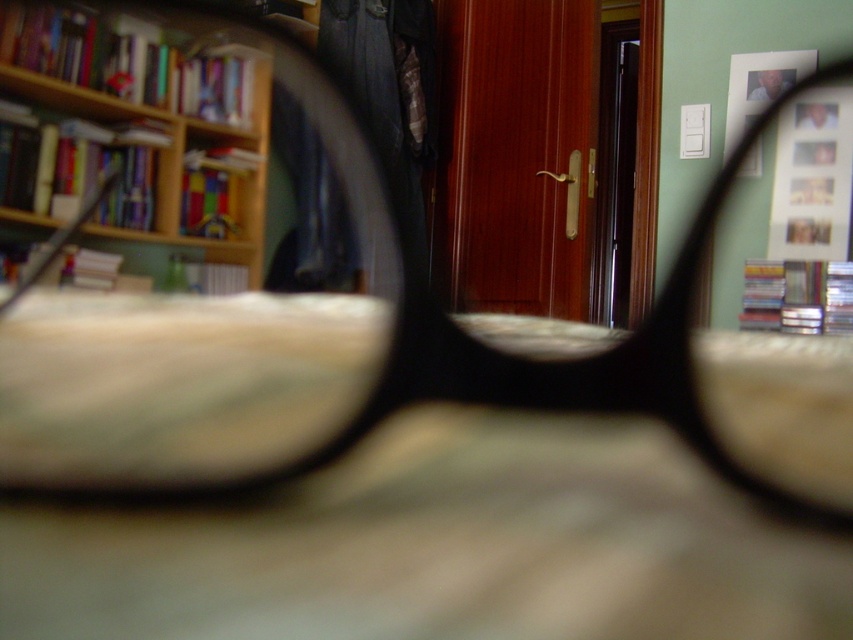
You are trying to decide whether to place the transparent plastic magnifying glass at center on the wooden bookcase at upper left. Based on their sizes, will it fit?

The transparent plastic magnifying glass at center is wider than the wooden bookcase at upper left, so it won

You are a delivery robot with a package that needs to be placed between the transparent plastic magnifying glass at center and the wooden bookcase at upper left. The package measures 10 centimeters in length. Can you fit the package in the space between them?

The transparent plastic magnifying glass at center and wooden bookcase at upper left are 8.75 centimeters apart. Since the package is 10 centimeters long, it cannot fit in the space between them as the distance is shorter than the package length.

You are standing in a room where you can see the wooden bookcase at upper left and the matte plastic picture frame at upper right. Which object is positioned more to the left side of the room?

The wooden bookcase at upper left is positioned more to the left side of the room than the matte plastic picture frame at upper right.